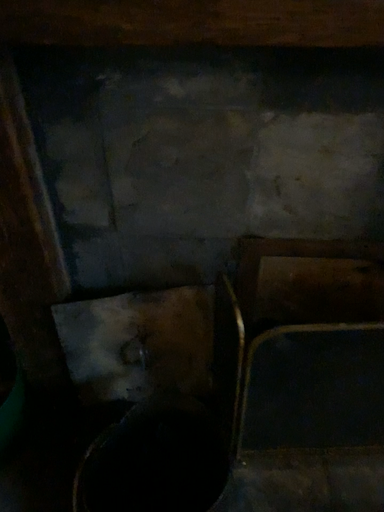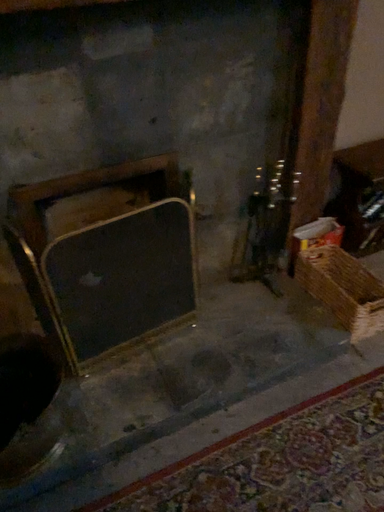
Question: How did the camera likely rotate when shooting the video?

Choices:
 (A) rotated upward
 (B) rotated downward

Answer: (A)